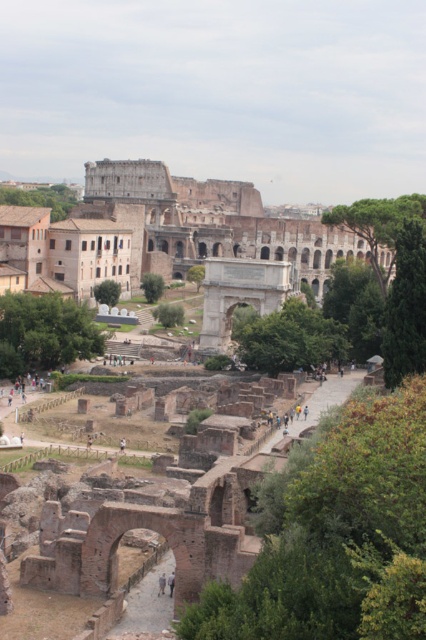
You are standing in the ancient Roman ruins scene with the Colosseum in the background. You see two items in the center area. Which object is positioned to the left? The options are the light brown leather shoes at center and the light brown leather jacket at center.

The light brown leather shoes at center are positioned to the left of the light brown leather jacket at center.

You are standing at the Colosseum ruins and see the light brown leather shoes at center. Where exactly are they located in the scene?

The light brown leather shoes at center are located at point (x=161, y=584).

You are standing at the ancient Roman ruins and notice two items in the center of the scene. Which item is shorter between the light brown leather shoes at center and the light brown leather jacket at center?

The light brown leather shoes at center is shorter than the light brown leather jacket at center because the shoes are not as tall as the jacket.